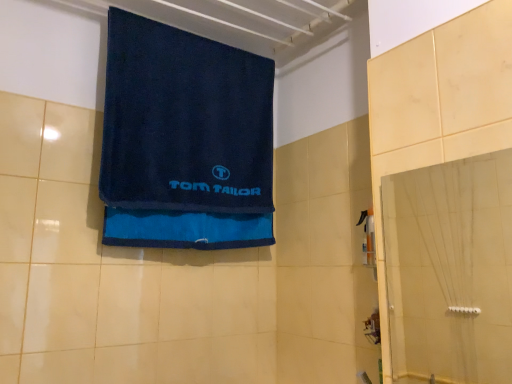
Describe the element at coordinates (450, 270) in the screenshot. I see `transparent glass door at right` at that location.

Identify the location of transparent glass door at right. This screenshot has height=384, width=512. (450, 270).

Image resolution: width=512 pixels, height=384 pixels. Find the location of `navy blue terry cloth towel at upper center`. navy blue terry cloth towel at upper center is located at coordinates (185, 140).

What do you see at coordinates (185, 140) in the screenshot? I see `navy blue terry cloth towel at upper center` at bounding box center [185, 140].

What is the approximate width of navy blue terry cloth towel at upper center?

It is 9.78 centimeters.

Identify the location of transparent glass door at right. The width and height of the screenshot is (512, 384). (450, 270).

Between transparent glass door at right and navy blue terry cloth towel at upper center, which one appears on the right side from the viewer's perspective?

transparent glass door at right is more to the right.

Relative to navy blue terry cloth towel at upper center, is transparent glass door at right in front or behind?

Visually, transparent glass door at right is located in front of navy blue terry cloth towel at upper center.

Is point (416, 171) farther from viewer compared to point (112, 114)?

Yes, it is behind point (112, 114).

From the image's perspective, which is above, transparent glass door at right or navy blue terry cloth towel at upper center?

navy blue terry cloth towel at upper center appears higher in the image.

From a real-world perspective, between transparent glass door at right and navy blue terry cloth towel at upper center, who is vertically lower?

In real-world perspective, transparent glass door at right is lower.

Which of these two, transparent glass door at right or navy blue terry cloth towel at upper center, is thinner?

Thinner between the two is transparent glass door at right.

Considering the sizes of objects transparent glass door at right and navy blue terry cloth towel at upper center in the image provided, who is shorter, transparent glass door at right or navy blue terry cloth towel at upper center?

Standing shorter between the two is transparent glass door at right.

Is transparent glass door at right bigger or smaller than navy blue terry cloth towel at upper center?

Clearly, transparent glass door at right is smaller in size than navy blue terry cloth towel at upper center.

Is navy blue terry cloth towel at upper center a part of transparent glass door at right?

No.

Are transparent glass door at right and navy blue terry cloth towel at upper center far apart?

Yes, transparent glass door at right and navy blue terry cloth towel at upper center are quite far apart.

Could you tell me if transparent glass door at right is turned towards navy blue terry cloth towel at upper center?

No, transparent glass door at right is not facing towards navy blue terry cloth towel at upper center.

Can you tell me how much transparent glass door at right and navy blue terry cloth towel at upper center differ in facing direction?

The facing directions of transparent glass door at right and navy blue terry cloth towel at upper center are 85.7 degrees apart.

Image resolution: width=512 pixels, height=384 pixels. Find the location of `towel on the left side of transparent glass door at right`. towel on the left side of transparent glass door at right is located at coordinates (185, 140).

Can you confirm if navy blue terry cloth towel at upper center is positioned to the right of transparent glass door at right?

Incorrect, navy blue terry cloth towel at upper center is not on the right side of transparent glass door at right.

Is navy blue terry cloth towel at upper center in front of or behind transparent glass door at right in the image?

navy blue terry cloth towel at upper center is behind transparent glass door at right.

Which is closer to the camera, (194, 220) or (438, 288)?

Positioned in front is point (194, 220).

Consider the image. From the image's perspective, between navy blue terry cloth towel at upper center and transparent glass door at right, which one is located above?

navy blue terry cloth towel at upper center appears higher in the image.

From a real-world perspective, is navy blue terry cloth towel at upper center above or below transparent glass door at right?

From a real-world perspective, navy blue terry cloth towel at upper center is physically above transparent glass door at right.

Which object is thinner, navy blue terry cloth towel at upper center or transparent glass door at right?

Thinner between the two is transparent glass door at right.

In the scene shown: Can you confirm if navy blue terry cloth towel at upper center is shorter than transparent glass door at right?

In fact, navy blue terry cloth towel at upper center may be taller than transparent glass door at right.

Considering the relative sizes of navy blue terry cloth towel at upper center and transparent glass door at right in the image provided, is navy blue terry cloth towel at upper center bigger than transparent glass door at right?

Correct, navy blue terry cloth towel at upper center is larger in size than transparent glass door at right.

Is navy blue terry cloth towel at upper center positioned beyond the bounds of transparent glass door at right?

Indeed, navy blue terry cloth towel at upper center is completely outside transparent glass door at right.

Is the surface of navy blue terry cloth towel at upper center in direct contact with transparent glass door at right?

No.

Is navy blue terry cloth towel at upper center facing away from transparent glass door at right?

No.

You are a GUI agent. You are given a task and a screenshot of the screen. Output one action in this format:
    pyautogui.click(x=<x>, y=<y>)
    Task: Click on the towel that is behind the transparent glass door at right
    
    Given the screenshot: What is the action you would take?
    pyautogui.click(x=185, y=140)

I want to click on towel lying behind the transparent glass door at right, so click(185, 140).

The height and width of the screenshot is (384, 512). In order to click on glass door on the right side of navy blue terry cloth towel at upper center in this screenshot , I will do `click(450, 270)`.